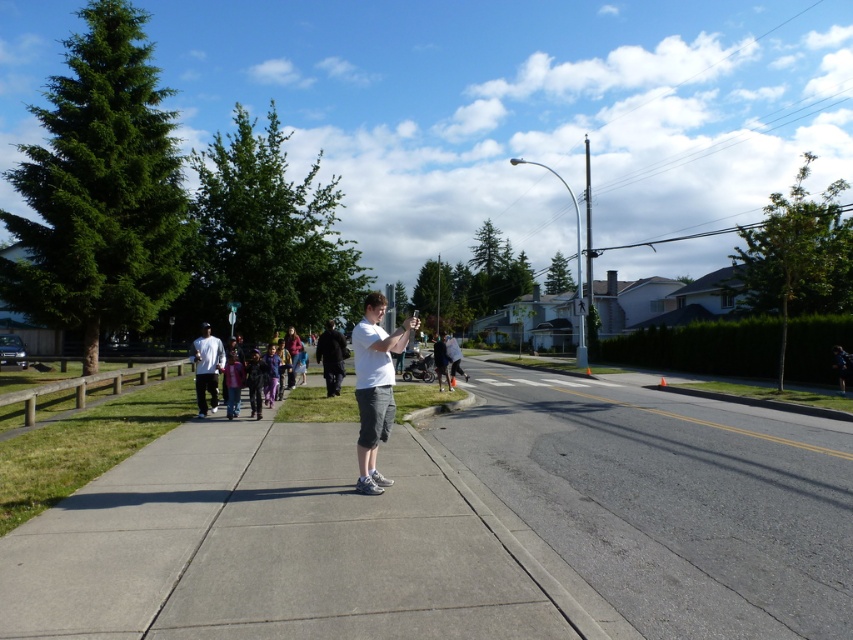
Is white cotton shirt at center positioned in front of light gray sweatshirt at center?

Yes, it is.

This screenshot has height=640, width=853. Identify the location of white cotton shirt at center. (375, 387).

Does point (341, 346) come closer to viewer compared to point (434, 368)?

Yes.

Who is taller, white matte shirt at center or dark gray pants at center?

With more height is white matte shirt at center.

Is point (338, 360) positioned before point (434, 362)?

Yes, point (338, 360) is closer to viewer.

What are the coordinates of `white matte shirt at center` in the screenshot? It's located at (331, 356).

Is gray asphalt road at center to the left of dark gray pants at center from the viewer's perspective?

In fact, gray asphalt road at center is to the right of dark gray pants at center.

Between point (512, 410) and point (445, 380), which one is positioned behind?

Point (445, 380)

Find the location of a particular element. The image size is (853, 640). gray asphalt road at center is located at coordinates (671, 500).